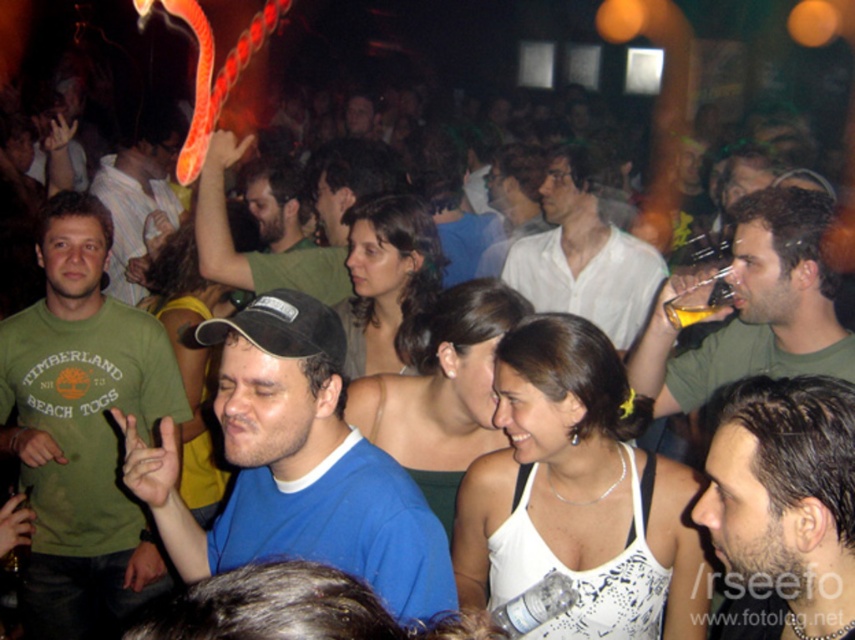
Question: Which of the following is the farthest from the observer?

Choices:
 (A) (682, 320)
 (B) (734, 285)

Answer: (A)

Question: Among these points, which one is nearest to the camera?

Choices:
 (A) (189, 529)
 (B) (626, 272)
 (C) (852, 502)
 (D) (753, 196)

Answer: (C)

Question: Does blue cotton t-shirt at center appear under translucent yellow glass at upper center?

Choices:
 (A) no
 (B) yes

Answer: (B)

Question: Does green matte shirt at center have a lesser width compared to white matte shirt at center?

Choices:
 (A) yes
 (B) no

Answer: (A)

Question: Which point appears farthest from the camera in this image?

Choices:
 (A) (28, 472)
 (B) (142, 131)

Answer: (B)

Question: Is green cotton t-shirt at left closer to camera compared to green cotton shirt at left?

Choices:
 (A) no
 (B) yes

Answer: (B)